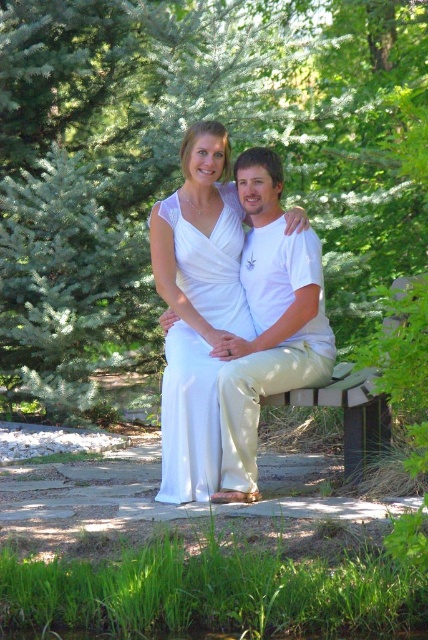
Question: Can you confirm if green leafy tree at upper center is wider than white satin dress at center?

Choices:
 (A) no
 (B) yes

Answer: (B)

Question: Is white cotton shirt at center above white satin dress at center?

Choices:
 (A) no
 (B) yes

Answer: (B)

Question: Which point appears closest to the camera in this image?

Choices:
 (A) (237, 243)
 (B) (279, 212)

Answer: (A)

Question: Which point is closer to the camera?

Choices:
 (A) (424, 243)
 (B) (228, 230)

Answer: (B)

Question: Does green leafy tree at upper center have a smaller size compared to wooden park bench at center?

Choices:
 (A) yes
 (B) no

Answer: (B)

Question: Which object appears farthest from the camera in this image?

Choices:
 (A) green leafy tree at upper center
 (B) white cotton shirt at center
 (C) white satin dress at center
 (D) wooden park bench at center

Answer: (A)